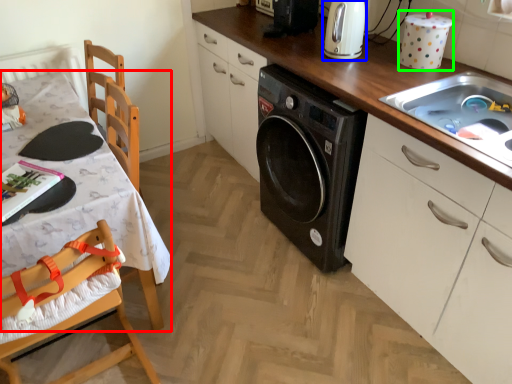
Question: Which is nearer to the table (highlighted by a red box)? home appliance (highlighted by a blue box) or appliance (highlighted by a green box).

Choices:
 (A) home appliance
 (B) appliance

Answer: (A)